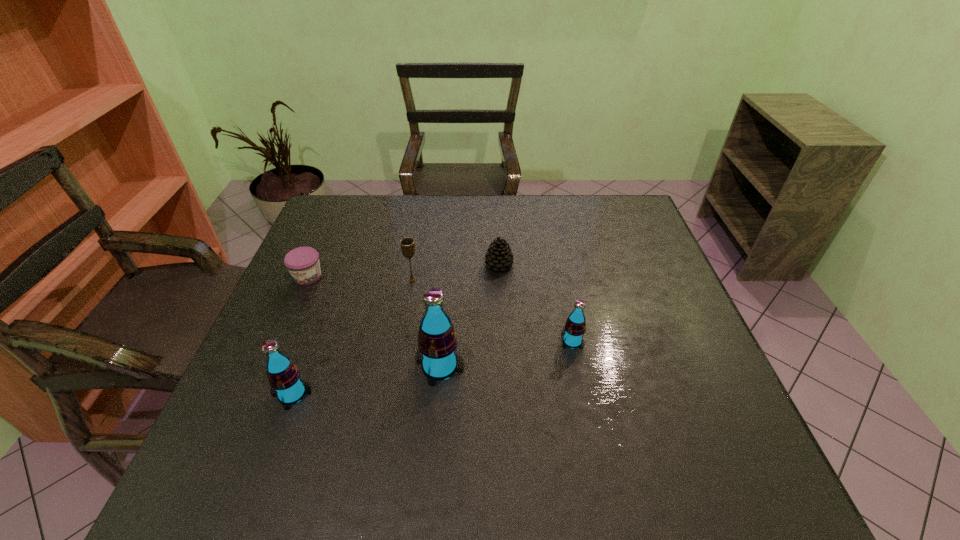
Find the location of a particular element. Image resolution: width=960 pixels, height=540 pixels. unoccupied area between the tallest soda and the shortest object is located at coordinates (373, 321).

The height and width of the screenshot is (540, 960). In order to click on free space between the shortest object and the pinecone in this screenshot , I will do `click(403, 271)`.

This screenshot has height=540, width=960. Find the location of `vacant area that lies between the shortest object and the pinecone`. vacant area that lies between the shortest object and the pinecone is located at coordinates (403, 271).

Where is `unoccupied area between the fifth tallest object and the shortest object`? The width and height of the screenshot is (960, 540). unoccupied area between the fifth tallest object and the shortest object is located at coordinates (403, 271).

Where is `free space that is in between the chalice and the fifth object from left to right`? free space that is in between the chalice and the fifth object from left to right is located at coordinates (456, 273).

Locate an element on the screen. This screenshot has width=960, height=540. object that stands as the fifth closest to the leftmost soda is located at coordinates (575, 326).

The width and height of the screenshot is (960, 540). Identify the location of object that stands as the closest to the second shortest object. point(407,244).

In order to click on soda that stands as the second closest to the shortest object in this screenshot , I will do `click(437, 343)`.

Identify the location of the second closest soda to the second shortest soda. [x=575, y=326].

The width and height of the screenshot is (960, 540). I want to click on vacant space that satisfies the following two spatial constraints: 1. at the narrow end of the pinecone; 2. on the front label of the shortest object, so click(x=499, y=276).